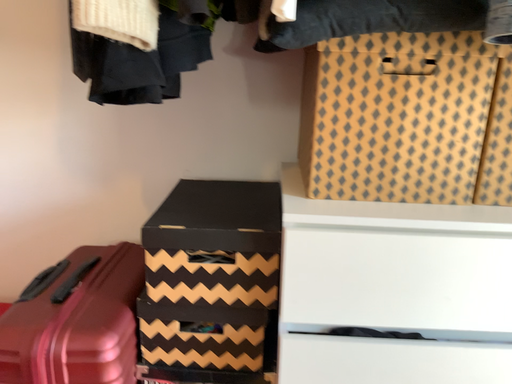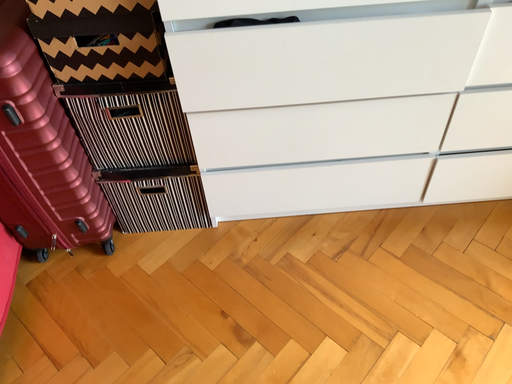
Question: Which way did the camera rotate in the video?

Choices:
 (A) rotated downward
 (B) rotated upward

Answer: (A)